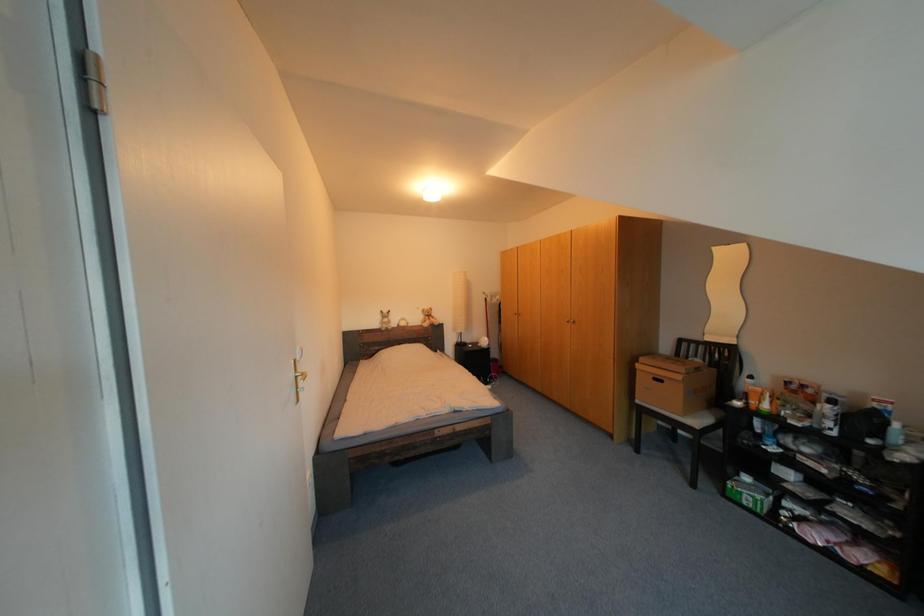
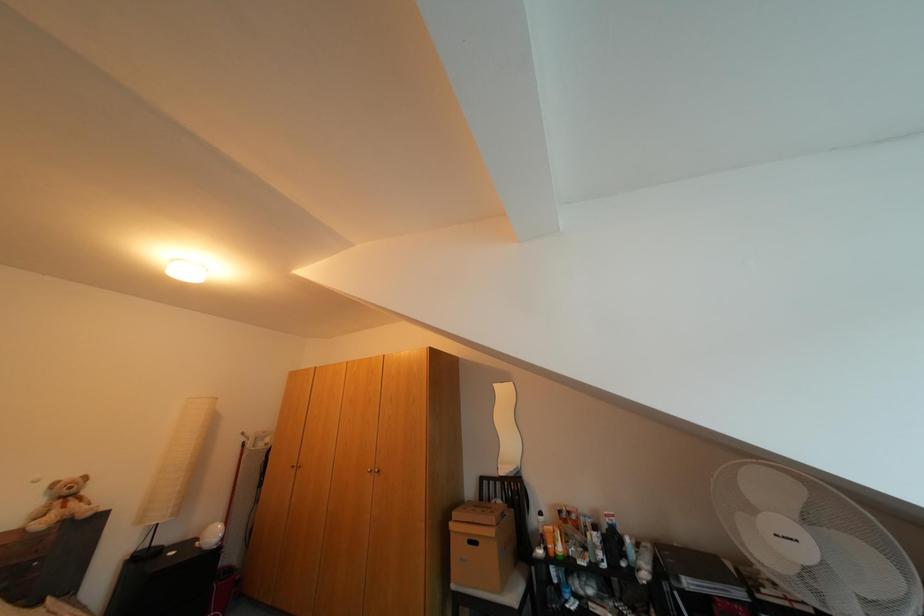
The first image is from the beginning of the video and the second image is from the end. How did the camera likely rotate when shooting the video?

The camera's rotation is toward right-up.